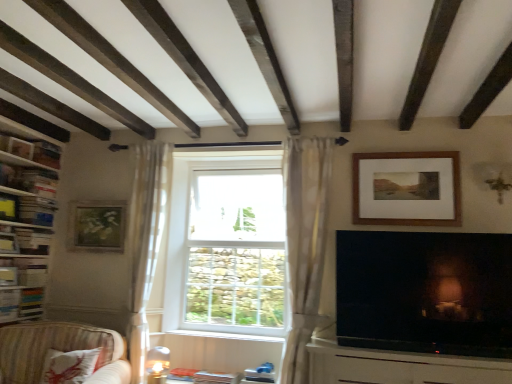
What are the coordinates of `blank space situated above wooden frame at upper right, which appears as the 2th picture frame when viewed from the left (from a real-world perspective)` in the screenshot? It's located at (403, 152).